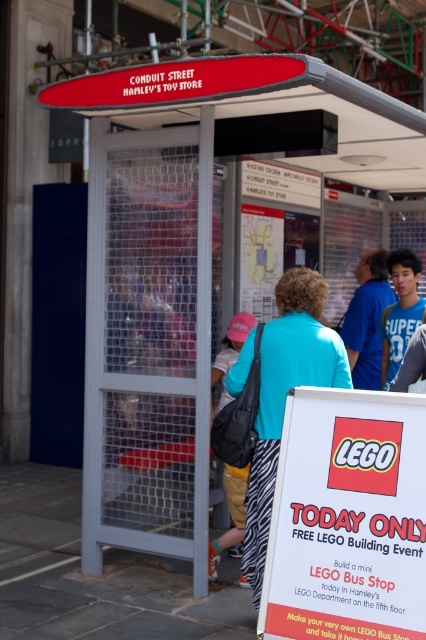
Question: Can you confirm if red plastic sign at upper center is smaller than light blue fabric shirt at center?

Choices:
 (A) yes
 (B) no

Answer: (B)

Question: Among these points, which one is nearest to the camera?

Choices:
 (A) (241, 496)
 (B) (373, 268)
 (C) (397, 342)

Answer: (A)

Question: Can you confirm if zebra print skirt at center is positioned to the left of blue cotton shirt at center?

Choices:
 (A) yes
 (B) no

Answer: (A)

Question: Which point appears closest to the camera in this image?

Choices:
 (A) (227, 326)
 (B) (356, 273)
 (C) (245, 506)

Answer: (C)

Question: In this image, where is white paper sign at center located relative to red plastic sign at upper center?

Choices:
 (A) right
 (B) left

Answer: (A)

Question: Which object appears farthest from the camera in this image?

Choices:
 (A) blue t-shirt at center
 (B) zebra print skirt at center
 (C) white paper sign at center
 (D) blue cotton shirt at center

Answer: (A)